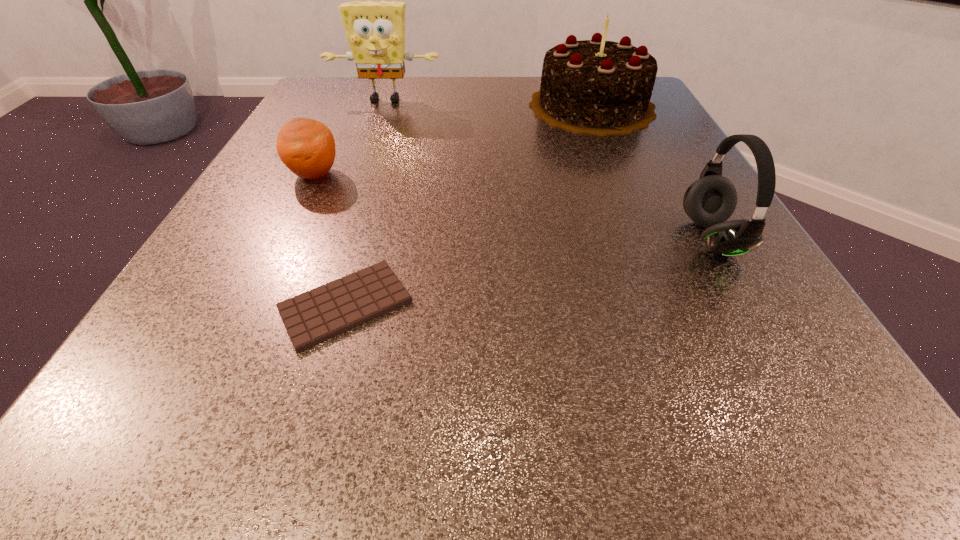
You are a GUI agent. You are given a task and a screenshot of the screen. Output one action in this format:
    pyautogui.click(x=<x>, y=<y>)
    Task: Click on the object at the far left corner
    
    Given the screenshot: What is the action you would take?
    pyautogui.click(x=375, y=30)

At what (x,y) coordinates should I click in order to perform the action: click on object that is positioned at the far right corner. Please return your answer as a coordinate pair (x, y). Image resolution: width=960 pixels, height=540 pixels. Looking at the image, I should click on (598, 87).

In the image, there is a desktop. Where is `vacant region at the far edge`? vacant region at the far edge is located at coordinates (408, 121).

In the image, there is a desktop. Where is `vacant space at the near edge`? The image size is (960, 540). vacant space at the near edge is located at coordinates (592, 411).

The height and width of the screenshot is (540, 960). In the image, there is a desktop. What are the coordinates of `free space at the left edge` in the screenshot? It's located at (228, 226).

The width and height of the screenshot is (960, 540). In the image, there is a desktop. What are the coordinates of `vacant space at the far left corner` in the screenshot? It's located at (383, 89).

Find the location of a particular element. The height and width of the screenshot is (540, 960). vacant position at the near left corner of the desktop is located at coordinates (232, 431).

Identify the location of empty location between the headset and the fourth tallest object. (513, 206).

The width and height of the screenshot is (960, 540). I want to click on vacant space that is in between the birthday cake and the sponge, so click(489, 103).

Where is `blank region between the headset and the third nearest object`? blank region between the headset and the third nearest object is located at coordinates (513, 206).